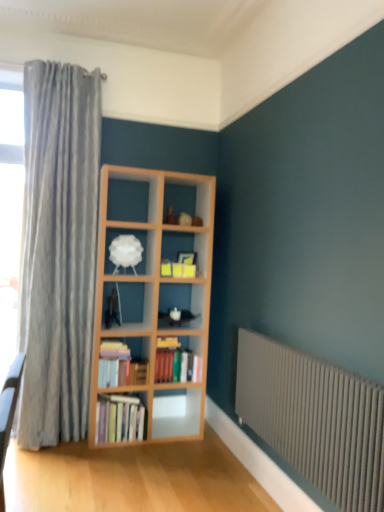
Looking at this image, measure the distance between gray metallic radiator at lower right and camera.

A distance of 5.52 feet exists between gray metallic radiator at lower right and camera.

Image resolution: width=384 pixels, height=512 pixels. I want to click on gray metallic radiator at lower right, so click(x=314, y=419).

This screenshot has height=512, width=384. Describe the element at coordinates (177, 365) in the screenshot. I see `hardcover books at center, acting as the 2th book starting from the bottom` at that location.

What do you see at coordinates (120, 366) in the screenshot? I see `hardcover books at center-left, which is counted as the 1th book, starting from the top` at bounding box center [120, 366].

I want to click on hardcover books at center, arranged as the first book when ordered from the bottom, so click(x=119, y=418).

Looking at this image, from a real-world perspective, does hardcover books at center-left, the 3th book positioned from the bottom, stand above gray metallic radiator at lower right?

No.

From the image's perspective, does hardcover books at center-left, the 3th book positioned from the bottom, appear lower than gray metallic radiator at lower right?

Actually, hardcover books at center-left, the 3th book positioned from the bottom, appears above gray metallic radiator at lower right in the image.

Would you say hardcover books at center-left, which is counted as the 1th book, starting from the top, is inside or outside gray metallic radiator at lower right?

The correct answer is: outside.

Who is more distant, hardcover books at center, which is the third book from top to bottom, or hardcover books at center-left, which is counted as the 1th book, starting from the top?

hardcover books at center, which is the third book from top to bottom, is more distant.

From the image's perspective, is hardcover books at center, which is the third book from top to bottom, below hardcover books at center-left, the 3th book positioned from the bottom?

Yes, from the image's perspective, hardcover books at center, which is the third book from top to bottom, is below hardcover books at center-left, the 3th book positioned from the bottom.

Is hardcover books at center, which is the third book from top to bottom, far from hardcover books at center-left, which is counted as the 1th book, starting from the top?

No, hardcover books at center, which is the third book from top to bottom, is not far from hardcover books at center-left, which is counted as the 1th book, starting from the top.

Is hardcover books at center, which is the third book from top to bottom, positioned beyond the bounds of hardcover books at center-left, the 3th book positioned from the bottom?

Yes, hardcover books at center, which is the third book from top to bottom, is outside of hardcover books at center-left, the 3th book positioned from the bottom.

At what (x,y) coordinates should I click in order to perform the action: click on the 2nd book above when counting from the gray metallic radiator at lower right (from the image's perspective). Please return your answer as a coordinate pair (x, y). Looking at the image, I should click on (120, 366).

What's the angular difference between gray metallic radiator at lower right and hardcover books at center-left, the 3th book positioned from the bottom,'s facing directions?

The angle between the facing direction of gray metallic radiator at lower right and the facing direction of hardcover books at center-left, the 3th book positioned from the bottom, is 92.1 degrees.

Considering the sizes of objects gray metallic radiator at lower right and hardcover books at center-left, the 3th book positioned from the bottom, in the image provided, who is shorter, gray metallic radiator at lower right or hardcover books at center-left, the 3th book positioned from the bottom,?

hardcover books at center-left, the 3th book positioned from the bottom, is shorter.

Consider the image. From a real-world perspective, is gray metallic radiator at lower right physically located above or below hardcover books at center-left, the 3th book positioned from the bottom?

gray metallic radiator at lower right is above hardcover books at center-left, the 3th book positioned from the bottom.

How far apart are white matte lampshade at center and hardcover books at center, arranged as the first book when ordered from the bottom?

white matte lampshade at center is 3.65 feet from hardcover books at center, arranged as the first book when ordered from the bottom.

Is white matte lampshade at center not close to hardcover books at center, arranged as the first book when ordered from the bottom?

white matte lampshade at center is positioned a significant distance from hardcover books at center, arranged as the first book when ordered from the bottom.

Is white matte lampshade at center in front of or behind hardcover books at center, which is the third book from top to bottom, in the image?

In the image, white matte lampshade at center appears behind hardcover books at center, which is the third book from top to bottom.

From the image's perspective, is white matte lampshade at center above or below hardcover books at center, arranged as the first book when ordered from the bottom?

Clearly, from the image's perspective, white matte lampshade at center is above hardcover books at center, arranged as the first book when ordered from the bottom.

Is white matte lampshade at center positioned with its back to hardcover books at center-left, which is counted as the 1th book, starting from the top?

No.

Is white matte lampshade at center smaller than hardcover books at center-left, which is counted as the 1th book, starting from the top?

Yes, white matte lampshade at center is smaller than hardcover books at center-left, which is counted as the 1th book, starting from the top.

Is hardcover books at center-left, which is counted as the 1th book, starting from the top, a part of white matte lampshade at center?

Definitely not — hardcover books at center-left, which is counted as the 1th book, starting from the top, is not inside white matte lampshade at center.

Is white matte lampshade at center shorter than hardcover books at center-left, the 3th book positioned from the bottom?

Yes.

I want to click on shelf located on the left of hardcover books at center, acting as the 2th book starting from the bottom, so click(126, 233).

Between hardcover books at center, placed as the second book when sorted from top to bottom, and white matte lampshade at center, which one is positioned behind?

hardcover books at center, placed as the second book when sorted from top to bottom.

Can we say hardcover books at center, acting as the 2th book starting from the bottom, lies outside white matte lampshade at center?

hardcover books at center, acting as the 2th book starting from the bottom, is positioned outside white matte lampshade at center.

From the picture: From the image's perspective, is hardcover books at center, acting as the 2th book starting from the bottom, positioned above or below white matte lampshade at center?

From the image's perspective, hardcover books at center, acting as the 2th book starting from the bottom, appears below white matte lampshade at center.

Who is bigger, hardcover books at center, acting as the 2th book starting from the bottom, or hardcover books at center, arranged as the first book when ordered from the bottom?

hardcover books at center, acting as the 2th book starting from the bottom.

Which book is the 2nd one when counting from the left side of the hardcover books at center, acting as the 2th book starting from the bottom? Please provide its 2D coordinates.

[(119, 418)]

Is hardcover books at center, acting as the 2th book starting from the bottom, positioned with its back to hardcover books at center, which is the third book from top to bottom?

No.

From the image's perspective, who appears lower, hardcover books at center, acting as the 2th book starting from the bottom, or hardcover books at center, which is the third book from top to bottom?

hardcover books at center, which is the third book from top to bottom.

Locate an element on the screen. The height and width of the screenshot is (512, 384). radiator to the right of hardcover books at center-left, the 3th book positioned from the bottom is located at coordinates (314, 419).

Identify the location of the 2nd book above the hardcover books at center, arranged as the first book when ordered from the bottom (from the image's perspective). The height and width of the screenshot is (512, 384). (x=120, y=366).

Looking at the image, which one is located closer to white matte lampshade at center, hardcover books at center, which is the third book from top to bottom, or gray metallic radiator at lower right?

The object closer to white matte lampshade at center is hardcover books at center, which is the third book from top to bottom.

From the image, which object appears to be farther from hardcover books at center, which is the third book from top to bottom, white matte lampshade at center or hardcover books at center, placed as the second book when sorted from top to bottom?

white matte lampshade at center is positioned further to the anchor hardcover books at center, which is the third book from top to bottom.

Considering their positions, is white matte lampshade at center positioned closer to hardcover books at center, placed as the second book when sorted from top to bottom, than hardcover books at center-left, which is counted as the 1th book, starting from the top?

hardcover books at center-left, which is counted as the 1th book, starting from the top, is positioned closer to the anchor hardcover books at center, placed as the second book when sorted from top to bottom.

When comparing their distances from hardcover books at center-left, the 3th book positioned from the bottom, does white matte lampshade at center or hardcover books at center, placed as the second book when sorted from top to bottom, seem closer?

hardcover books at center, placed as the second book when sorted from top to bottom, lies closer to hardcover books at center-left, the 3th book positioned from the bottom, than the other object.

Which object lies nearer to the anchor point hardcover books at center, acting as the 2th book starting from the bottom, hardcover books at center-left, the 3th book positioned from the bottom, or white matte lampshade at center?

Based on the image, hardcover books at center-left, the 3th book positioned from the bottom, appears to be nearer to hardcover books at center, acting as the 2th book starting from the bottom.

When comparing their distances from gray metallic radiator at lower right, does hardcover books at center, placed as the second book when sorted from top to bottom, or white matte lampshade at center seem further?

Among the two, white matte lampshade at center is located further to gray metallic radiator at lower right.

When comparing their distances from hardcover books at center, acting as the 2th book starting from the bottom, does gray metallic radiator at lower right or hardcover books at center-left, the 3th book positioned from the bottom, seem closer?

hardcover books at center-left, the 3th book positioned from the bottom, lies closer to hardcover books at center, acting as the 2th book starting from the bottom, than the other object.

When comparing their distances from white matte lampshade at center, does hardcover books at center-left, which is counted as the 1th book, starting from the top, or gray metallic radiator at lower right seem further?

gray metallic radiator at lower right.

Where is `book between gray metallic radiator at lower right and hardcover books at center, which is the third book from top to bottom, along the z-axis`? book between gray metallic radiator at lower right and hardcover books at center, which is the third book from top to bottom, along the z-axis is located at coordinates (120, 366).

Where is `book between white matte lampshade at center and hardcover books at center, placed as the second book when sorted from top to bottom, in the up-down direction`? The height and width of the screenshot is (512, 384). book between white matte lampshade at center and hardcover books at center, placed as the second book when sorted from top to bottom, in the up-down direction is located at coordinates (120, 366).

Find the location of a particular element. This screenshot has height=512, width=384. shelf located between gray metallic radiator at lower right and hardcover books at center, acting as the 2th book starting from the bottom, in the depth direction is located at coordinates (126, 233).

Locate an element on the screen. The height and width of the screenshot is (512, 384). book that lies between hardcover books at center-left, the 3th book positioned from the bottom, and hardcover books at center, which is the third book from top to bottom, from top to bottom is located at coordinates (177, 365).